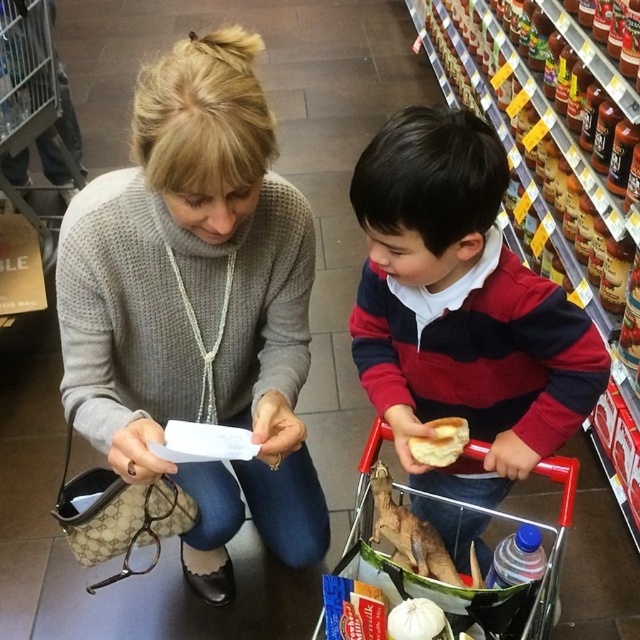
Question: Does metallic silver trolley at lower center appear over white matte garlic at lower center?

Choices:
 (A) yes
 (B) no

Answer: (A)

Question: Which of the following is the closest to the observer?

Choices:
 (A) red plastic shopping cart at lower center
 (B) metallic silver trolley at lower center

Answer: (A)

Question: Which of these objects is positioned farthest from the golden crispy bread at lower center?

Choices:
 (A) metallic silver trolley at lower center
 (B) white matte garlic at lower center
 (C) knit sweater at center
 (D) brown matte chicken at lower center

Answer: (A)

Question: Does knit sweater at center appear on the left side of red plastic shopping cart at lower center?

Choices:
 (A) yes
 (B) no

Answer: (A)

Question: Is golden crispy bread at lower center above white matte garlic at lower center?

Choices:
 (A) yes
 (B) no

Answer: (A)

Question: Which object is the farthest from the metallic silver trolley at lower center?

Choices:
 (A) brown matte chicken at lower center
 (B) red plastic shopping cart at lower center
 (C) matte red sweater at center
 (D) golden crispy bread at lower center

Answer: (D)